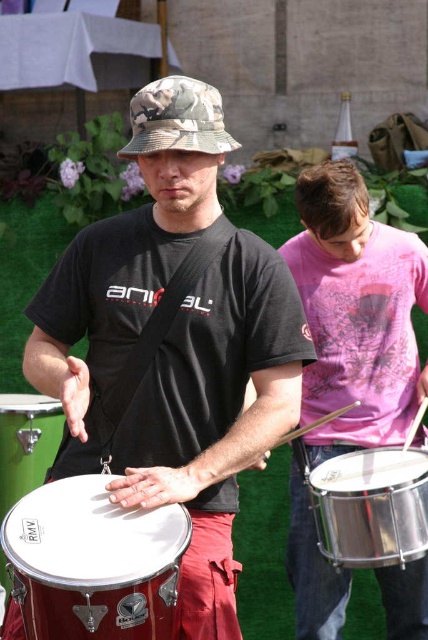
Can you confirm if matte black drum at center is thinner than pink cotton shirt at right?

No, matte black drum at center is not thinner than pink cotton shirt at right.

Who is positioned more to the left, matte black drum at center or pink cotton shirt at right?

matte black drum at center is more to the left.

Who is more distant from viewer, (291, 403) or (403, 326)?

The point (403, 326) is more distant.

Where is `matte black drum at center`? matte black drum at center is located at coordinates (172, 346).

Does point (172, 582) come behind point (32, 420)?

No.

Is metallic red drum at center in front of green matte drum at center?

Yes.

Is point (139, 580) in front of point (42, 452)?

Yes, point (139, 580) is in front of point (42, 452).

Image resolution: width=428 pixels, height=640 pixels. I want to click on metallic red drum at center, so click(94, 563).

Is matte black drum at center thinner than green matte drum at center?

No.

Which is behind, point (106, 285) or point (58, 419)?

Positioned behind is point (58, 419).

Where is `matte black drum at center`? The height and width of the screenshot is (640, 428). matte black drum at center is located at coordinates (172, 346).